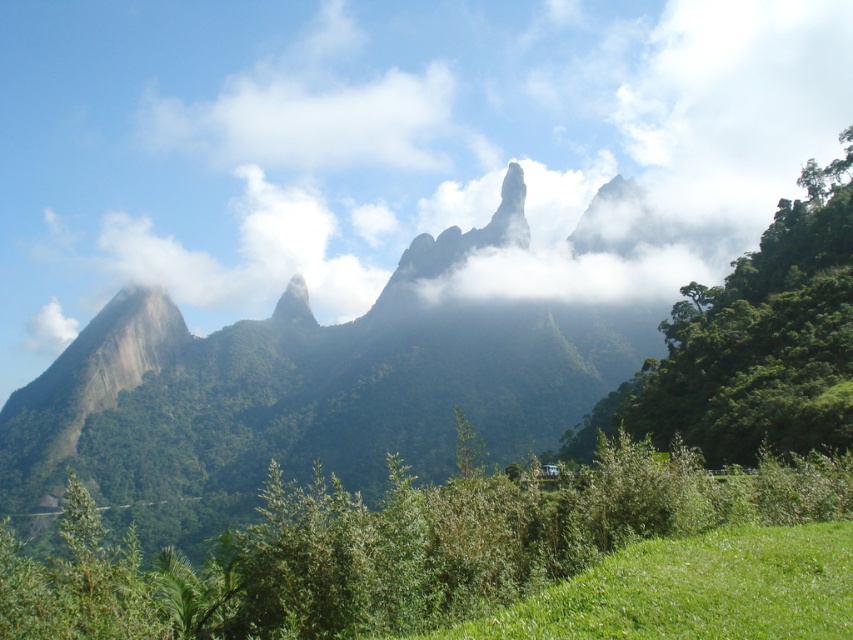
You are an astronomer observing the sky in this mountain landscape. You notice a celestial object at point [392,148]. Is this object a star or a cloud?

The object at point [392,148] is a white fluffy cloud at upper center, so it is a cloud.

You are an airplane pilot flying over the mountain range. You notice the white fluffy cloud at upper center and the smooth granite peak at center. Which object is positioned closer to your airplane?

The white fluffy cloud at upper center is closer to the viewer than the smooth granite peak at center, so the white fluffy cloud at upper center is positioned closer to your airplane.

You are a mountain climber planning to reach the summit of the smooth granite peak at center. You notice a white fluffy cloud at upper center above it. Can you determine if the cloud is higher than the peak?

The white fluffy cloud at upper center has a greater height compared to the smooth granite peak at center, so yes, the cloud is higher than the peak.